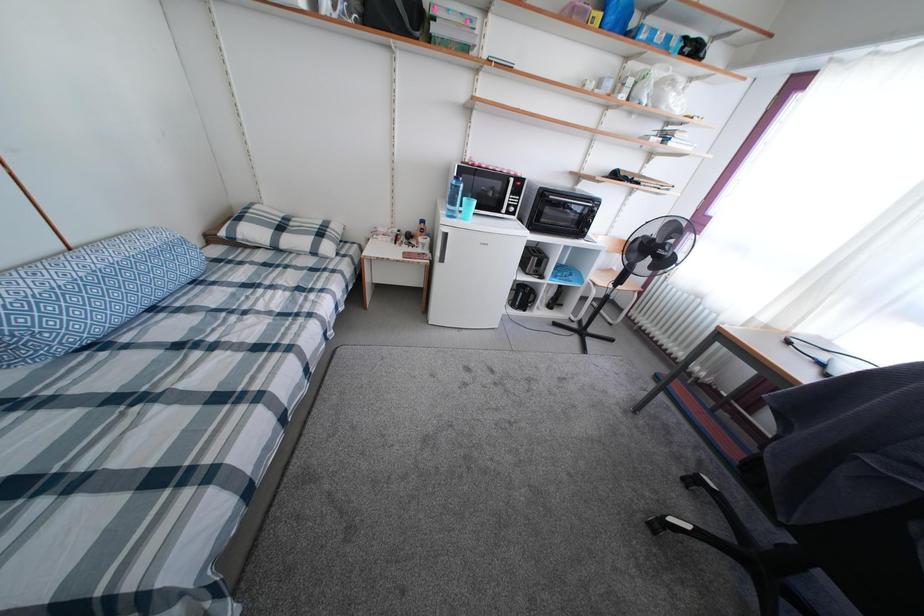
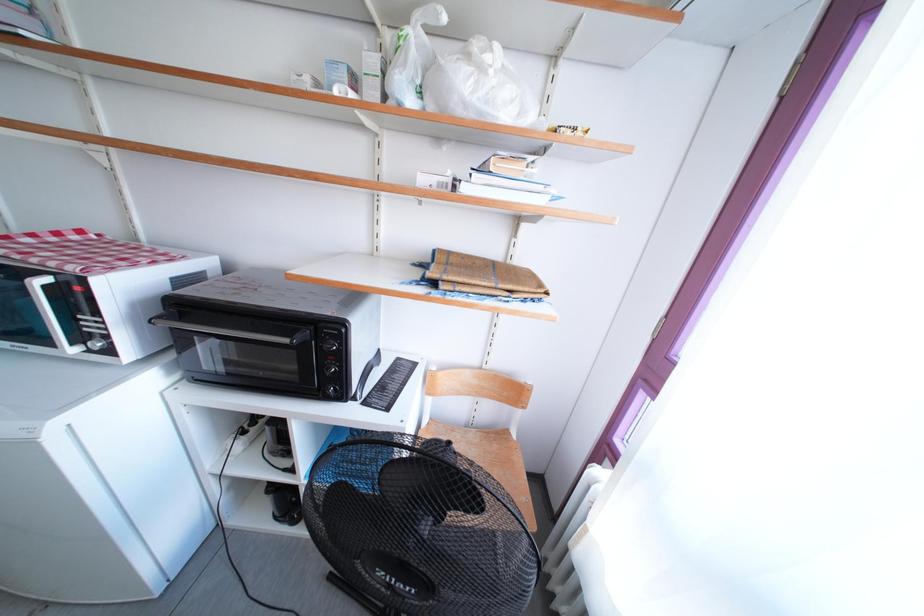
Looking at this image, which direction would the cameraman need to move to produce the second image?

The movement direction of the cameraman is right, forward.